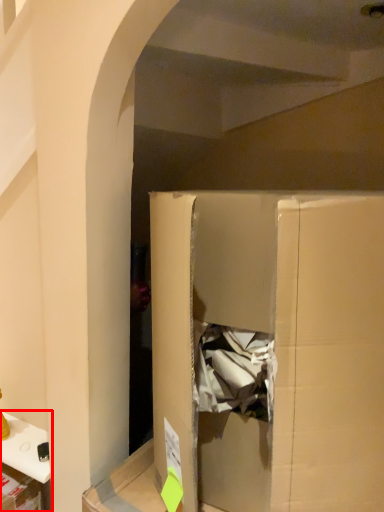
Question: From the image's perspective, where is furniture (annotated by the red box) located in relation to cardboard box in the image?

Choices:
 (A) below
 (B) above

Answer: (A)